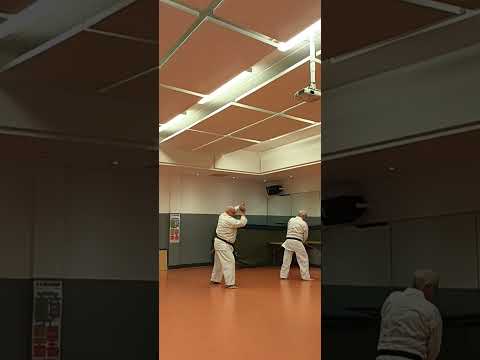
In order to click on projector in this screenshot , I will do `click(308, 97)`.